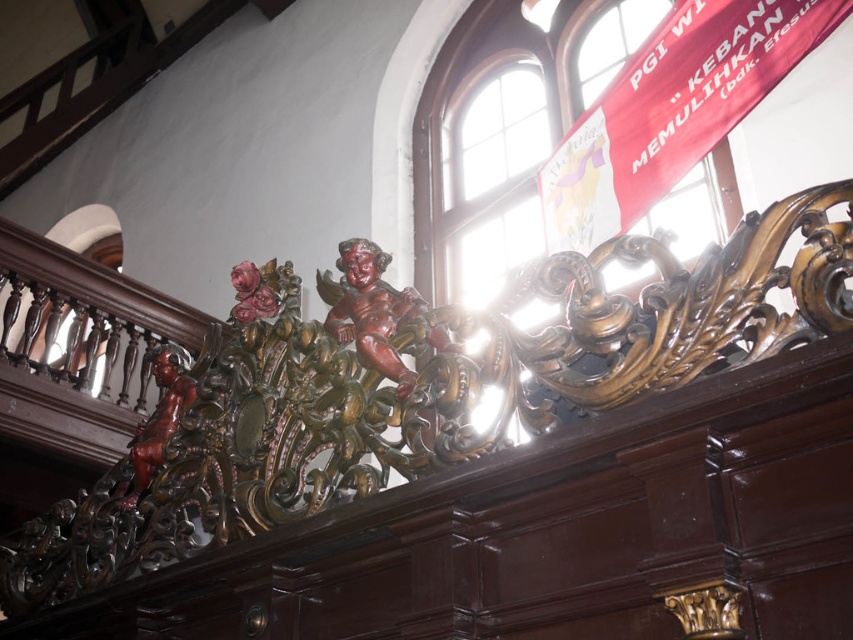
Question: Where is wooden carving at center located in relation to polished dark wood cherub at center in the image?

Choices:
 (A) right
 (B) left

Answer: (B)

Question: Which object is positioned farthest from the polished dark wood cherub at center?

Choices:
 (A) wooden carving at center
 (B) transparent glass window at upper center

Answer: (B)

Question: Does transparent glass window at upper center appear on the left side of polished dark wood cherub at center?

Choices:
 (A) no
 (B) yes

Answer: (A)

Question: Does wooden carving at center have a greater width compared to polished dark wood cherub at center?

Choices:
 (A) no
 (B) yes

Answer: (B)

Question: Which point is farther to the camera?

Choices:
 (A) wooden carving at center
 (B) transparent glass window at upper center
 (C) polished dark wood cherub at center

Answer: (B)

Question: Which point appears closest to the camera in this image?

Choices:
 (A) (606, 269)
 (B) (410, 397)

Answer: (A)